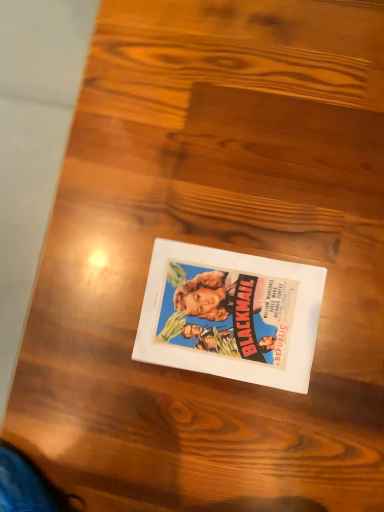
What do you see at coordinates (230, 315) in the screenshot? I see `matte paper book at center` at bounding box center [230, 315].

This screenshot has height=512, width=384. I want to click on matte paper book at center, so click(230, 315).

Locate an element on the screen. matte paper book at center is located at coordinates (230, 315).